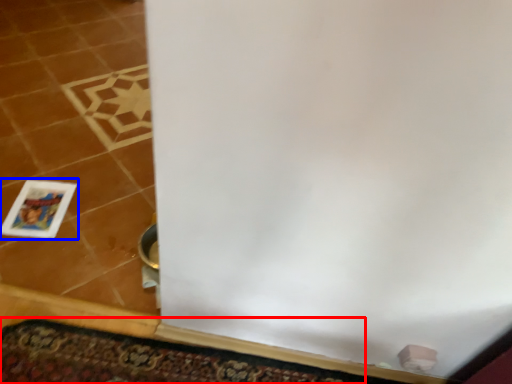
Question: Among these objects, which one is farthest to the camera, doormat (highlighted by a red box) or picture frame (highlighted by a blue box)?

Choices:
 (A) doormat
 (B) picture frame

Answer: (B)